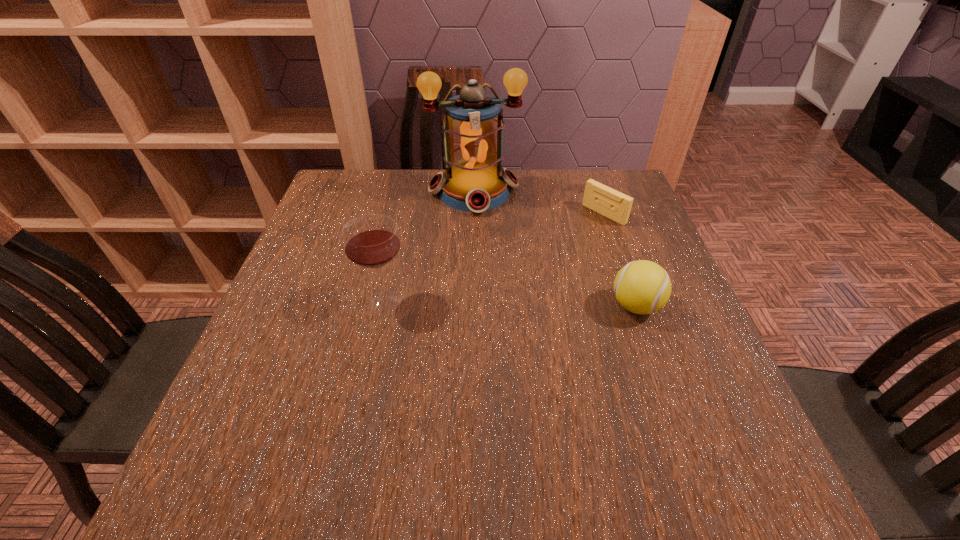
Locate an element on the screen. This screenshot has height=540, width=960. vacant point at the left edge is located at coordinates (332, 256).

Locate an element on the screen. This screenshot has width=960, height=540. blank space at the right edge of the desktop is located at coordinates (612, 224).

The height and width of the screenshot is (540, 960). Identify the location of vacant space at the far left corner. (327, 184).

You are a GUI agent. You are given a task and a screenshot of the screen. Output one action in this format:
    pyautogui.click(x=<x>, y=<y>)
    Task: Click on the vacant space at the near left corner of the desktop
    Image resolution: width=960 pixels, height=540 pixels.
    Given the screenshot: What is the action you would take?
    pyautogui.click(x=276, y=408)

In order to click on free space at the far right corner of the desktop in this screenshot , I will do `click(584, 179)`.

Find the location of a particular element. free space at the near right corner of the desktop is located at coordinates (652, 437).

Locate an element on the screen. empty space that is in between the third shortest object and the second shortest object is located at coordinates (x=510, y=303).

Locate an element on the screen. free space between the videotape and the lantern is located at coordinates (539, 202).

What are the coordinates of `vacant space in between the second tallest object and the shortest object` in the screenshot? It's located at (494, 257).

This screenshot has width=960, height=540. I want to click on free space between the videotape and the second shortest object, so click(620, 260).